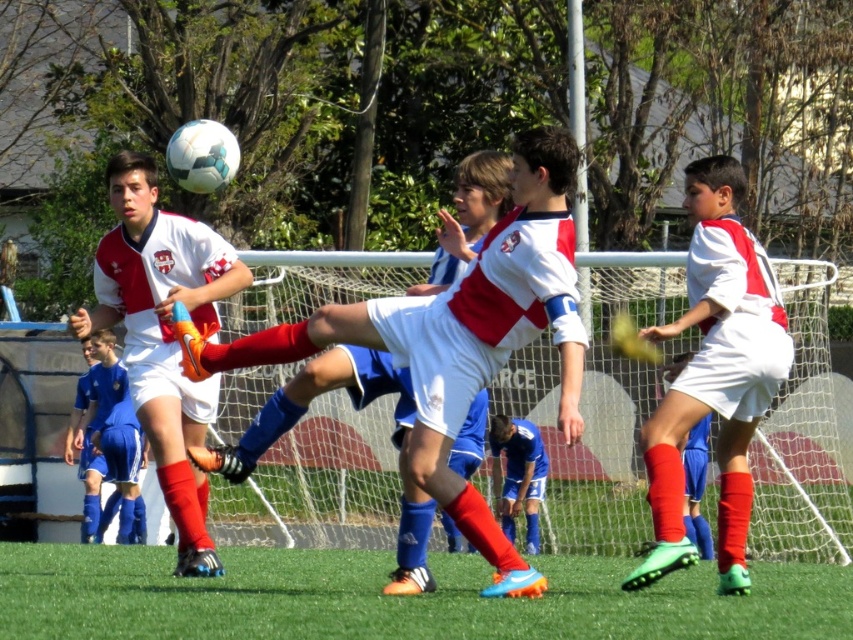
You are a soccer player wearing white matte shorts at center. You want to kick the ball that is on the green turf at center. Can you reach the ball without moving your feet?

The green turf at center is below white matte shorts at center, so yes, the ball on the green turf at center is within reach of the player wearing white matte shorts at center without moving their feet.

You are a soccer coach analyzing the game. You notice the white matte shorts at center and the matte white soccer ball at upper center. Which object has a smaller width?

The white matte shorts at center has a width less than the matte white soccer ball at upper center, so the white matte shorts at center is smaller in width.